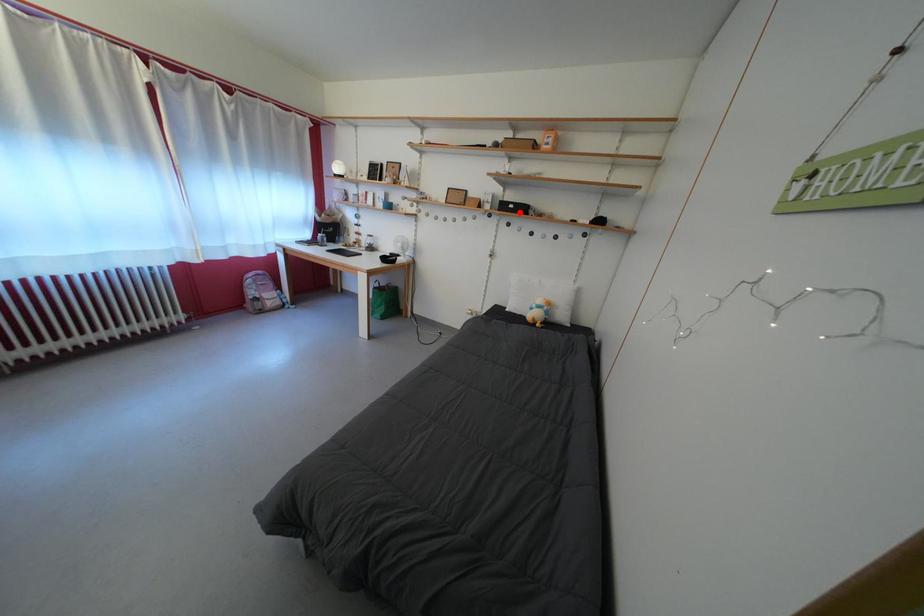
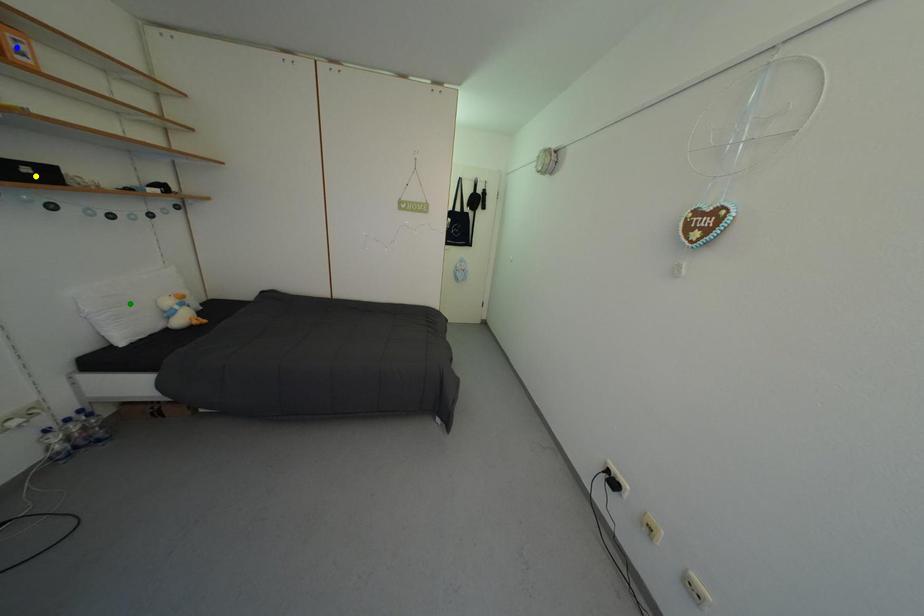
Question: I am providing you with two images of the same scene from different viewpoints. A red point is marked on the first image. You are given multiple points on the second image. In image 2, which mark is for the same physical point as the one in image 1?

Choices:
 (A) blue point
 (B) yellow point
 (C) green point

Answer: (B)